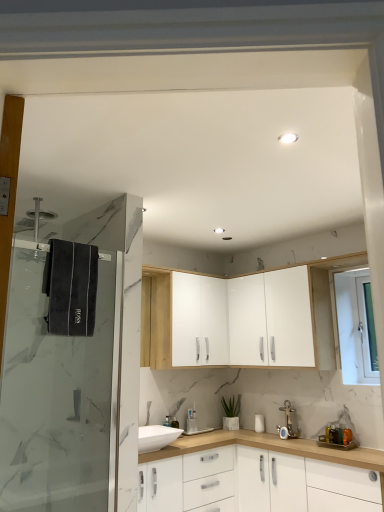
Locate an element on the screen. This screenshot has height=512, width=384. vacant space to the left of white glossy light fixture at upper center is located at coordinates (259, 136).